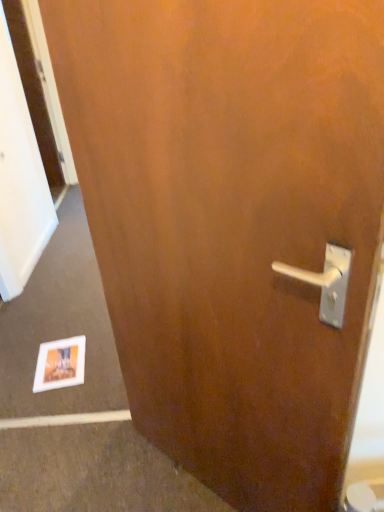
Question: Should I look upward or downward to see matte paper postcard at lower left?

Choices:
 (A) up
 (B) down

Answer: (B)

Question: Is wooden screen door at left aimed at matte paper postcard at lower left?

Choices:
 (A) no
 (B) yes

Answer: (A)

Question: Considering the relative sizes of wooden screen door at left and matte paper postcard at lower left in the image provided, is wooden screen door at left wider than matte paper postcard at lower left?

Choices:
 (A) no
 (B) yes

Answer: (A)

Question: Is wooden screen door at left smaller than matte paper postcard at lower left?

Choices:
 (A) no
 (B) yes

Answer: (A)

Question: Is wooden screen door at left outside matte paper postcard at lower left?

Choices:
 (A) no
 (B) yes

Answer: (B)

Question: Can you confirm if wooden screen door at left is bigger than matte paper postcard at lower left?

Choices:
 (A) no
 (B) yes

Answer: (B)

Question: Is wooden screen door at left looking in the opposite direction of matte paper postcard at lower left?

Choices:
 (A) no
 (B) yes

Answer: (A)

Question: From a real-world perspective, is matte paper postcard at lower left positioned under wooden screen door at left based on gravity?

Choices:
 (A) no
 (B) yes

Answer: (B)

Question: Is the position of matte paper postcard at lower left more distant than that of wooden screen door at left?

Choices:
 (A) no
 (B) yes

Answer: (A)

Question: Can you confirm if matte paper postcard at lower left is bigger than wooden screen door at left?

Choices:
 (A) no
 (B) yes

Answer: (A)

Question: Can you confirm if matte paper postcard at lower left is shorter than wooden screen door at left?

Choices:
 (A) no
 (B) yes

Answer: (B)

Question: Is matte paper postcard at lower left to the right of wooden screen door at left from the viewer's perspective?

Choices:
 (A) no
 (B) yes

Answer: (B)

Question: Is the position of matte paper postcard at lower left less distant than that of wooden screen door at left?

Choices:
 (A) no
 (B) yes

Answer: (B)

Question: Visually, is matte paper postcard at lower left positioned to the left or to the right of wooden screen door at left?

Choices:
 (A) left
 (B) right

Answer: (B)